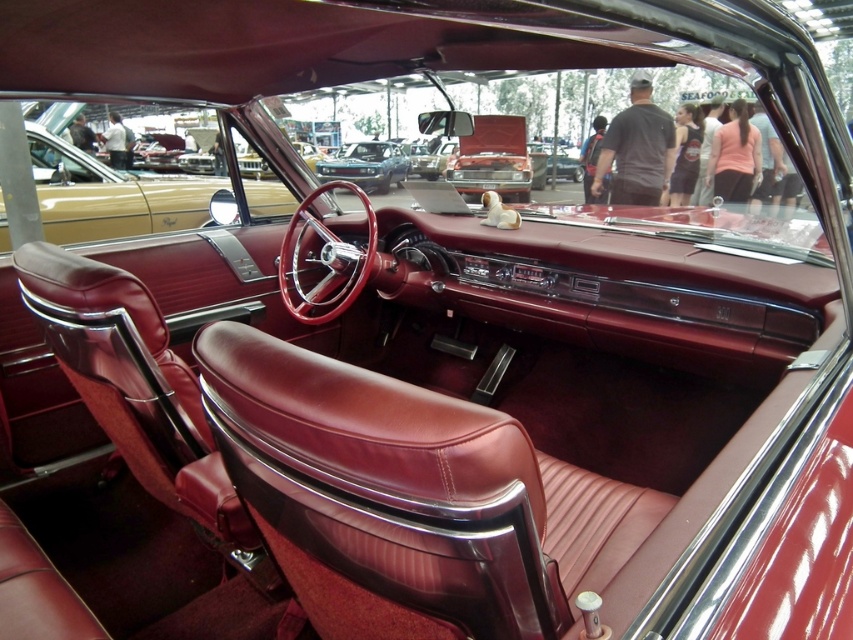
Question: Among these objects, which one is nearest to the camera?

Choices:
 (A) metallic blue car at center
 (B) maroon leather steering wheel at center

Answer: (B)

Question: Which object is closer to the camera taking this photo?

Choices:
 (A) maroon leather steering wheel at center
 (B) metallic blue car at center

Answer: (A)

Question: Does maroon leather steering wheel at center come behind metallic blue car at center?

Choices:
 (A) no
 (B) yes

Answer: (A)

Question: Can you confirm if maroon leather steering wheel at center is wider than metallic blue car at center?

Choices:
 (A) yes
 (B) no

Answer: (A)

Question: Which object is farther from the camera taking this photo?

Choices:
 (A) maroon leather steering wheel at center
 (B) metallic blue car at center

Answer: (B)

Question: Considering the relative positions of maroon leather steering wheel at center and metallic blue car at center in the image provided, where is maroon leather steering wheel at center located with respect to metallic blue car at center?

Choices:
 (A) left
 (B) right

Answer: (A)